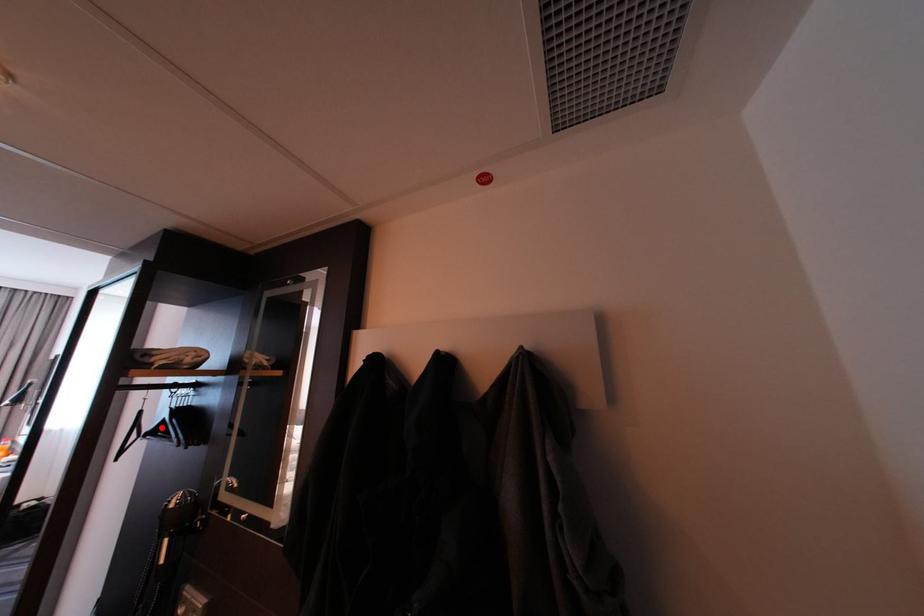
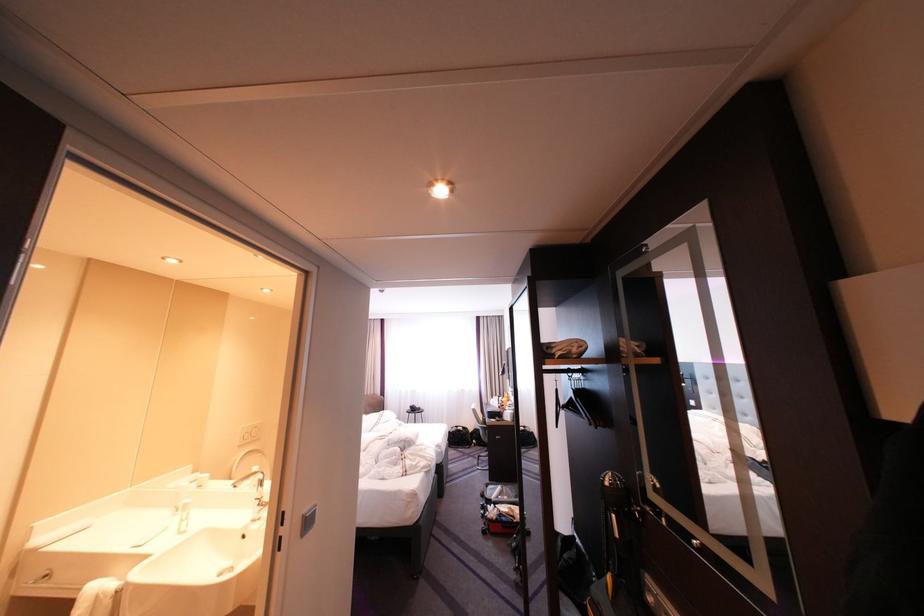
Question: I am providing you with two images of the same scene from different viewpoints. Given a red point in image1, look at the same physical point in image2. Is it:

Choices:
 (A) Closer to the viewpoint
 (B) Farther from the viewpoint

Answer: (B)